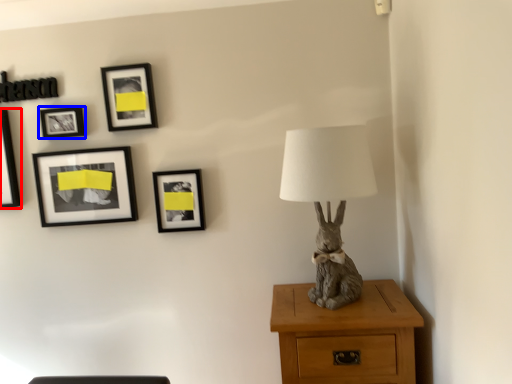
Question: Which object is further to the camera taking this photo, picture frame (highlighted by a red box) or picture frame (highlighted by a blue box)?

Choices:
 (A) picture frame
 (B) picture frame

Answer: (A)